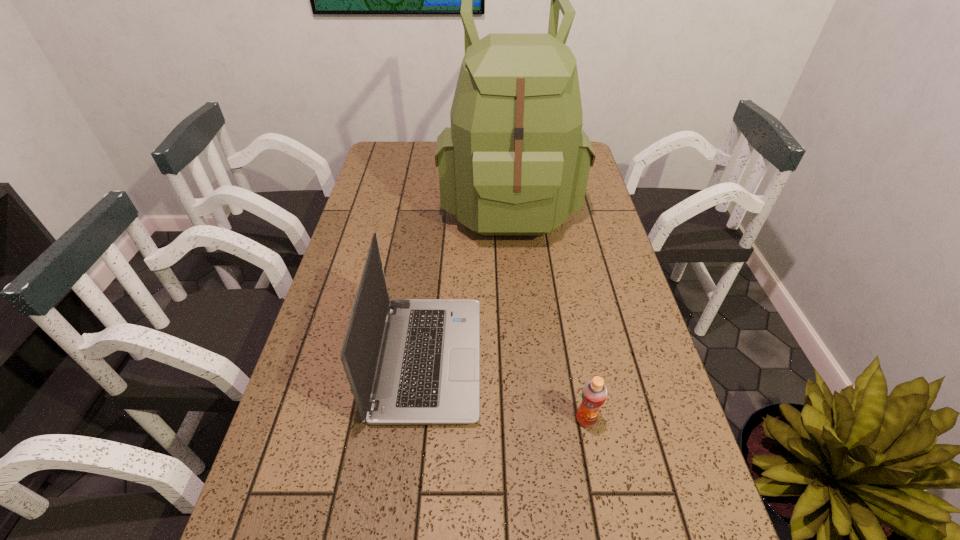
Identify the location of free space at the left edge of the desktop. This screenshot has height=540, width=960. (300, 383).

Where is `free space at the right edge of the desktop`? Image resolution: width=960 pixels, height=540 pixels. free space at the right edge of the desktop is located at coordinates (637, 405).

The height and width of the screenshot is (540, 960). In the image, there is a desktop. In order to click on vacant space at the far left corner in this screenshot , I will do `click(416, 159)`.

I want to click on empty space between the laptop computer and the backpack, so click(468, 279).

Locate an element on the screen. Image resolution: width=960 pixels, height=540 pixels. free point between the second tallest object and the shortest object is located at coordinates (507, 389).

You are a GUI agent. You are given a task and a screenshot of the screen. Output one action in this format:
    pyautogui.click(x=<x>, y=<y>)
    Task: Click on the free area in between the laptop computer and the shortest object
    Image resolution: width=960 pixels, height=540 pixels.
    Given the screenshot: What is the action you would take?
    pyautogui.click(x=507, y=389)

The image size is (960, 540). In order to click on free space between the farthest object and the orange juice in this screenshot , I will do `click(547, 309)`.

Identify which object is located as the second nearest to the shortest object. Please provide its 2D coordinates. Your answer should be formatted as a tuple, i.e. [(x, y)], where the tuple contains the x and y coordinates of a point satisfying the conditions above.

[(516, 161)]

Point out which object is positioned as the nearest to the orange juice. Please provide its 2D coordinates. Your answer should be formatted as a tuple, i.e. [(x, y)], where the tuple contains the x and y coordinates of a point satisfying the conditions above.

[(427, 373)]

You are a GUI agent. You are given a task and a screenshot of the screen. Output one action in this format:
    pyautogui.click(x=<x>, y=<y>)
    Task: Click on the free location that satisfies the following two spatial constraints: 1. on the screen of the orange juice; 2. on the left side of the second shortest object
    The width and height of the screenshot is (960, 540).
    Given the screenshot: What is the action you would take?
    (422, 419)